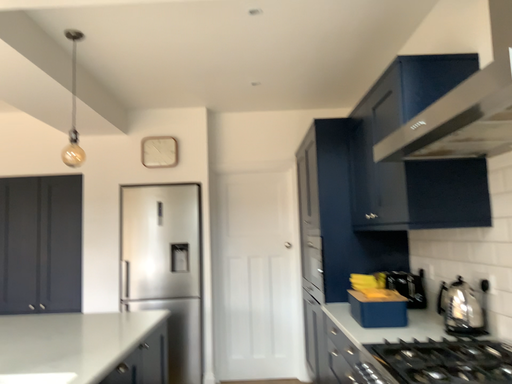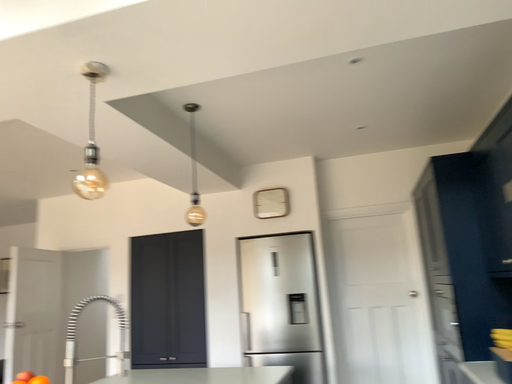
Question: How did the camera likely rotate when shooting the video?

Choices:
 (A) rotated left
 (B) rotated right

Answer: (A)